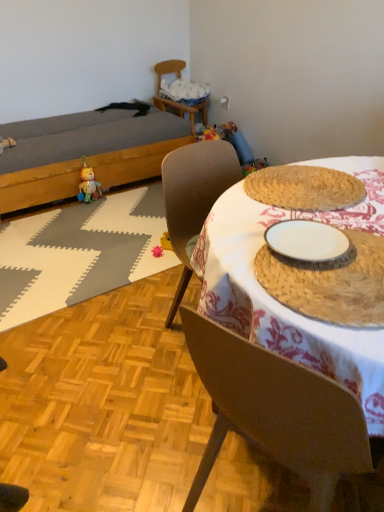
Identify the location of vacant area that is in front of plush yellow bear at lower left, the second toy from the right. (90, 211).